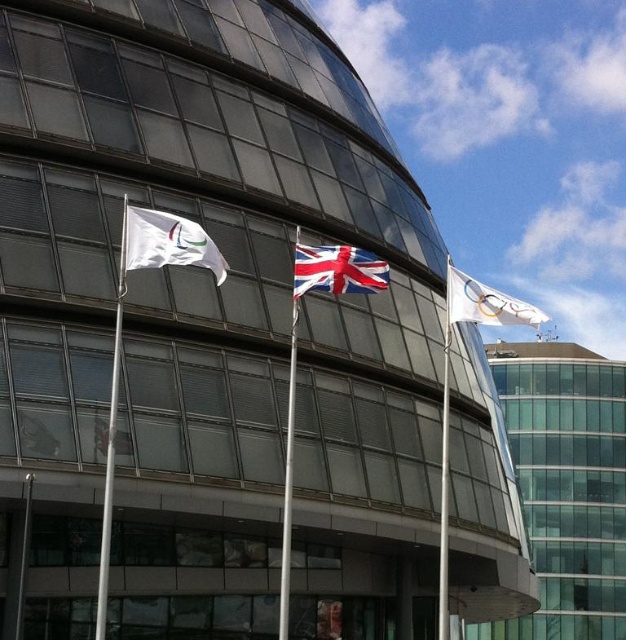
Question: Can you confirm if white plastic flag pole at left is thinner than red fabric flag at center?

Choices:
 (A) yes
 (B) no

Answer: (B)

Question: Does white fabric flag at upper left appear on the right side of white plastic flag pole at left?

Choices:
 (A) yes
 (B) no

Answer: (A)

Question: Which of the following is the farthest from the observer?

Choices:
 (A) (451, 308)
 (B) (443, 403)

Answer: (B)

Question: Which object is the farthest from the white glossy flag at upper right?

Choices:
 (A) white metallic flag pole at center
 (B) white fabric flag at upper left
 (C) red fabric flag at center
 (D) white plastic flag pole at left

Answer: (C)

Question: Which point is farther to the camera?

Choices:
 (A) (289, 486)
 (B) (105, 454)
 (C) (121, 248)

Answer: (B)

Question: Is white fabric flag at upper left positioned behind white metallic flag pole at center?

Choices:
 (A) no
 (B) yes

Answer: (B)